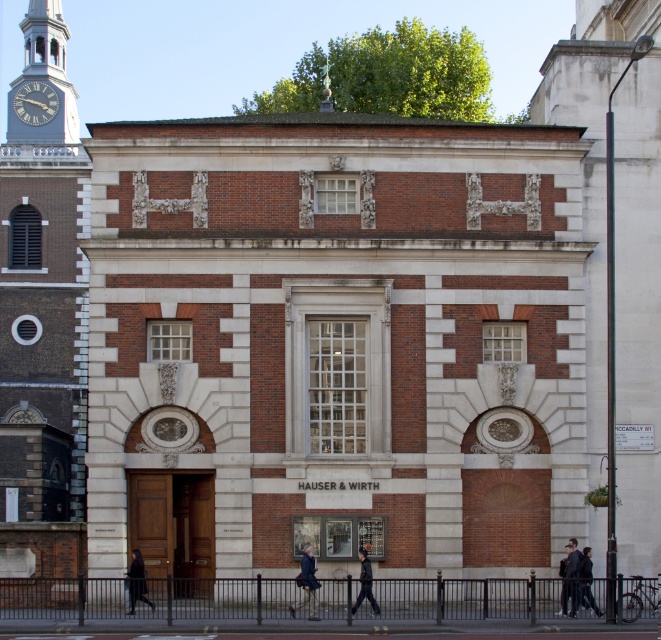
You are standing in front of the historic building and notice the silver metallic clock tower at upper left and the dark brown leather coat at lower center. Which object is wider?

The silver metallic clock tower at upper left might be wider than dark brown leather coat at lower center according to the description.

You are standing in front of the historic building and want to walk from the point at coordinates point (305, 568) to the point at coordinates point (582, 580). Can you directly walk in a straight line between them without any obstacles?

Point point (305, 568) is behind point point (582, 580), so you cannot walk directly in a straight line between them without obstacles.

You are an interior designer assessing the space in front of the HAUSER WIRTH building. You have a dark blue fabric at center and a dark blue jacket at lower right. Which object would require more horizontal space if placed on a narrow shelf?

The dark blue fabric at center requires more horizontal space because its width is larger than the dark blue jacket at lower right.